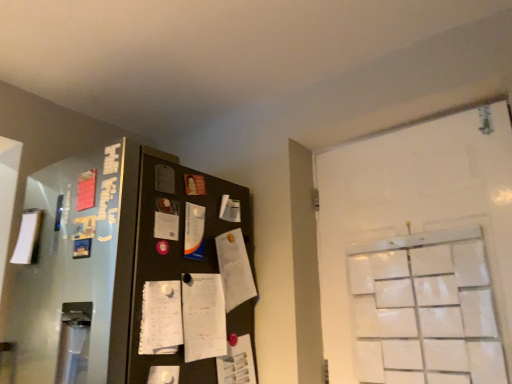
Question: Considering their positions, is white matte door at right located in front of or behind white glossy paper at center, which is the third paper in bottom-to-top order?

Choices:
 (A) behind
 (B) front

Answer: (B)

Question: Is point (486, 177) positioned closer to the camera than point (189, 236)?

Choices:
 (A) closer
 (B) farther

Answer: (A)

Question: Based on their relative distances, which object is nearer to the white glossy paper at center, the second paper viewed from the left?

Choices:
 (A) white matte door at right
 (B) white paper notepad at center
 (C) white matte paper at left, the 2th paper when ordered from top to bottom
 (D) white paper at center, acting as the third paper starting from the left

Answer: (B)

Question: Estimate the real-world distances between objects in this image. Which object is closer to the white paper notepad at center?

Choices:
 (A) white glossy paper at center, acting as the first paper starting from the top
 (B) white matte paper at left, placed as the 2th paper when sorted from bottom to top
 (C) white matte door at right
 (D) white paper at center, positioned as the first paper in right-to-left order

Answer: (D)